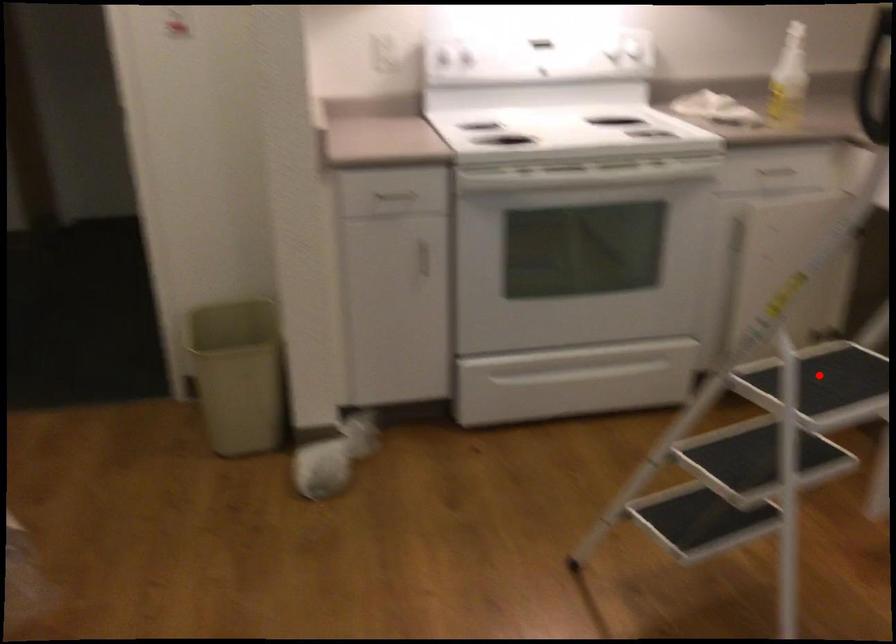
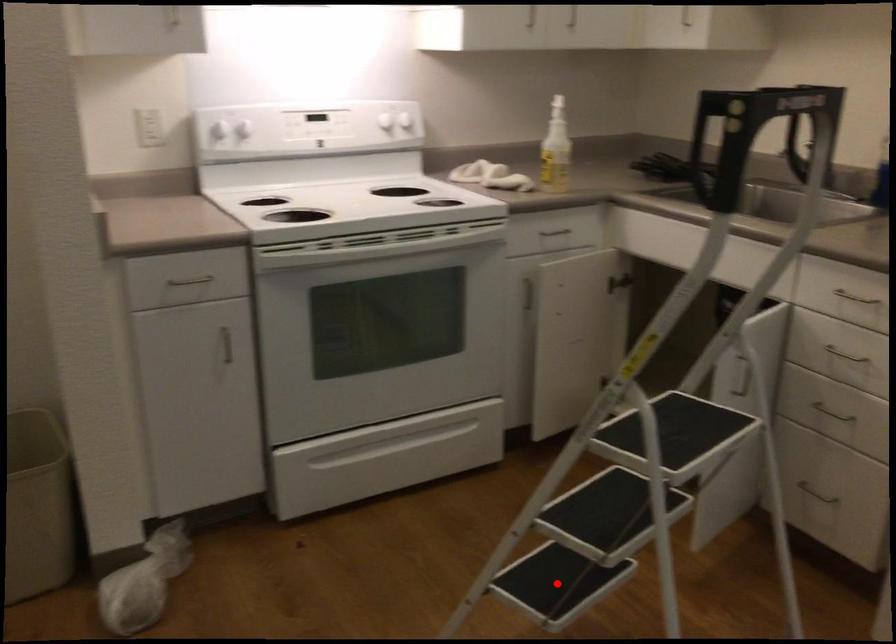
I am providing you with two images of the same scene from different viewpoints. A red point is marked on the first image and another point is marked on the second image. Do the highlighted points in image1 and image2 indicate the same real-world spot?

No